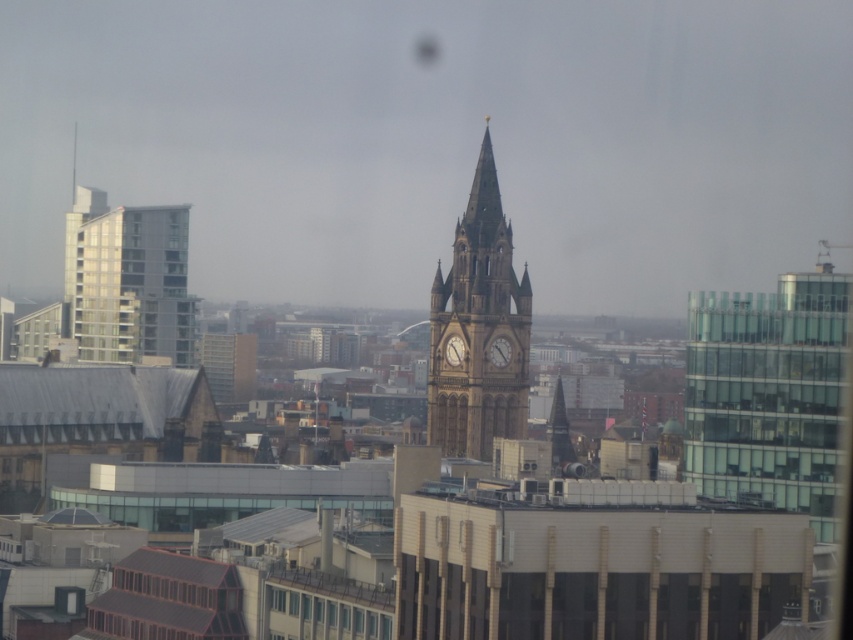
Consider the image. Is clear glass windows at center wider than golden stone spire at upper center?

Correct, the width of clear glass windows at center exceeds that of golden stone spire at upper center.

Based on the photo, which of these two, clear glass windows at center or golden stone spire at upper center, stands shorter?

Standing shorter between the two is clear glass windows at center.

Who is more distant from viewer, (341,609) or (73,170)?

The point (73,170) is behind.

Where is `clear glass windows at center`? clear glass windows at center is located at coordinates (323, 609).

Which is more to the left, clear glass windows at center or golden stone clock at center?

Positioned to the left is clear glass windows at center.

Can you confirm if clear glass windows at center is positioned to the left of golden stone clock at center?

Indeed, clear glass windows at center is positioned on the left side of golden stone clock at center.

Find the location of a particular element. The image size is (853, 640). clear glass windows at center is located at coordinates (323, 609).

I want to click on clear glass windows at center, so click(323, 609).

This screenshot has width=853, height=640. I want to click on clear glass windows at center, so click(323, 609).

Does clear glass windows at center lie behind matte brown clock at center?

No, clear glass windows at center is in front of matte brown clock at center.

Identify the location of clear glass windows at center. Image resolution: width=853 pixels, height=640 pixels. (323, 609).